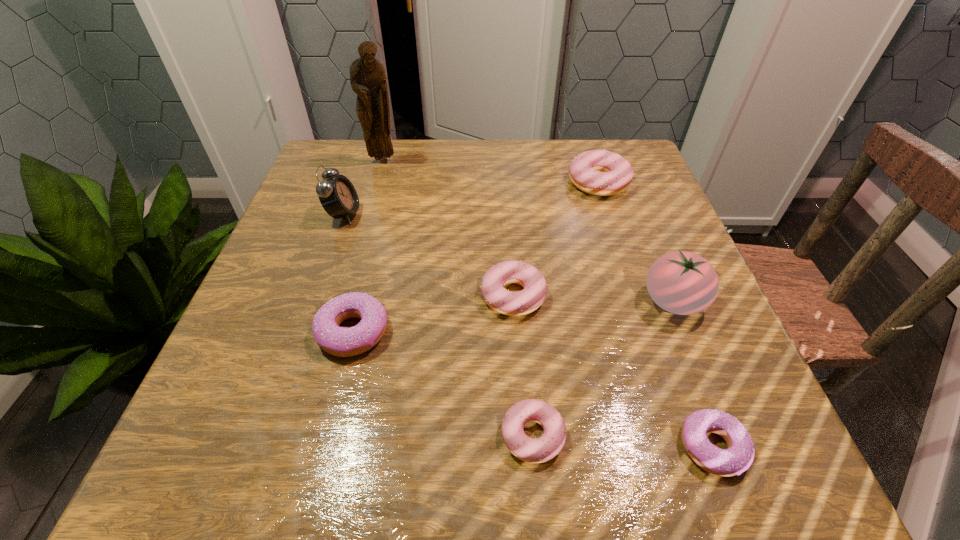
The height and width of the screenshot is (540, 960). I want to click on vacant space at the near edge of the desktop, so click(x=577, y=482).

In the image, there is a desktop. Identify the location of vacant space at the left edge. (287, 301).

I want to click on free spot at the right edge of the desktop, so click(712, 348).

This screenshot has height=540, width=960. I want to click on vacant region at the far left corner of the desktop, so click(314, 170).

In the image, there is a desktop. Where is `vacant space at the near right corner`? The height and width of the screenshot is (540, 960). vacant space at the near right corner is located at coordinates (787, 449).

The height and width of the screenshot is (540, 960). Identify the location of vacant point located between the second smallest pink doughnut and the fifth shortest object. click(556, 239).

Identify the location of vacant area between the second smallest pink doughnut and the sixth nearest object. (428, 255).

Identify the location of vacant space that is in between the white alarm clock and the smallest pink doughnut. (438, 325).

I want to click on vacant area that lies between the smallest pink doughnut and the farther purple doughnut, so click(443, 383).

The height and width of the screenshot is (540, 960). Identify the location of vacant area between the rightmost pink doughnut and the red tomato. (636, 241).